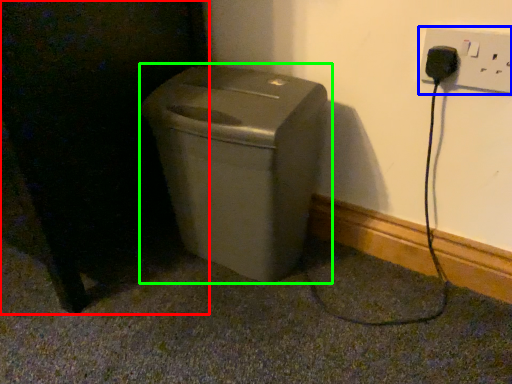
Question: Which object is positioned farthest from dark (highlighted by a red box)? Select from electric outlet (highlighted by a blue box) and waste container (highlighted by a green box).

Choices:
 (A) electric outlet
 (B) waste container

Answer: (A)